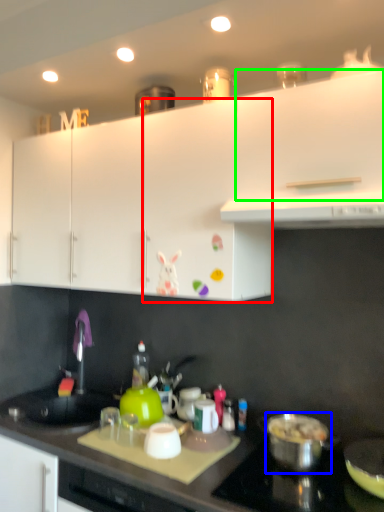
Question: Which object is the closest to the cabinetry (highlighted by a red box)? Choose among these: kitchen appliance (highlighted by a blue box) or cabinetry (highlighted by a green box).

Choices:
 (A) kitchen appliance
 (B) cabinetry

Answer: (B)